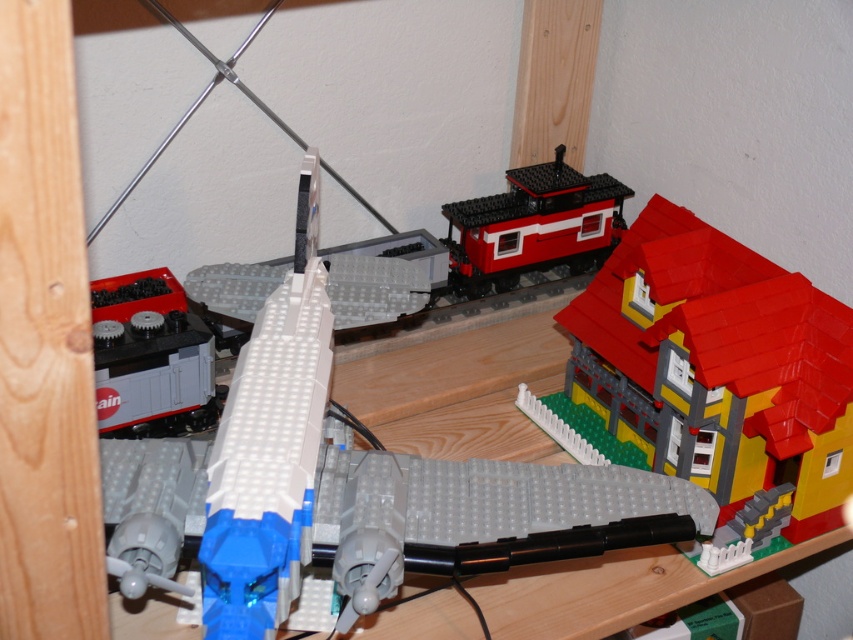
Where is the yellow matte house at center right located in the image?

The yellow matte house at center right is located at point (717, 365) in the image.